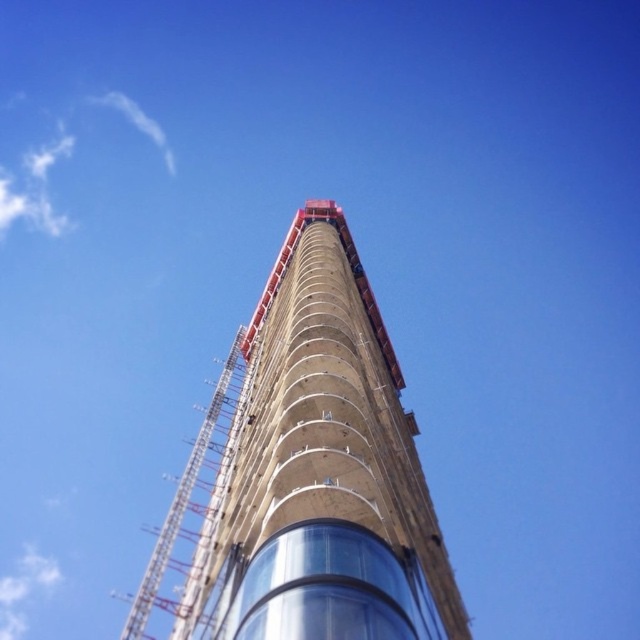
Based on the photo, you are standing at the base of the tall cylindrical structure and want to locate the point at coordinates (320, 470). According to the image, what material would you expect to find at that point?

The point at coordinates (320, 470) corresponds to concrete at center, so you would expect to find concrete there.

You are an architect reviewing the construction site. You notice the concrete at center and the metallic scaffolding at center. Which of these two elements has a larger size according to the description?

The metallic scaffolding at center is larger than the concrete at center.

You are an architect reviewing the construction site of a tall cylindrical building. You have two points marked on your blueprint at coordinates point (285, 320) and point (177, 512). If you were to walk from the first point to the second, would you be moving closer to or farther from the viewer? Please explain your reasoning based on the points provided.

Moving from point (285, 320) to point (177, 512) would mean moving farther from the viewer because point (285, 320) is closer to the viewer than point (177, 512) according to the description.